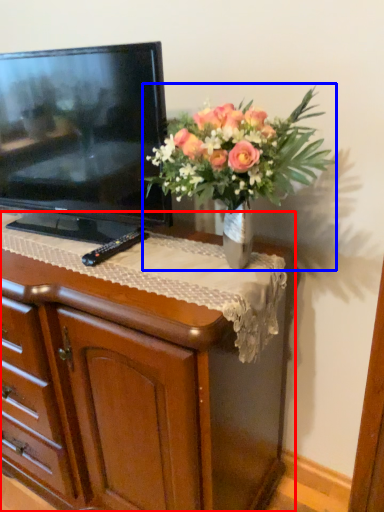
Question: Among these objects, which one is farthest to the camera, chest of drawers (highlighted by a red box) or houseplant (highlighted by a blue box)?

Choices:
 (A) chest of drawers
 (B) houseplant

Answer: (A)